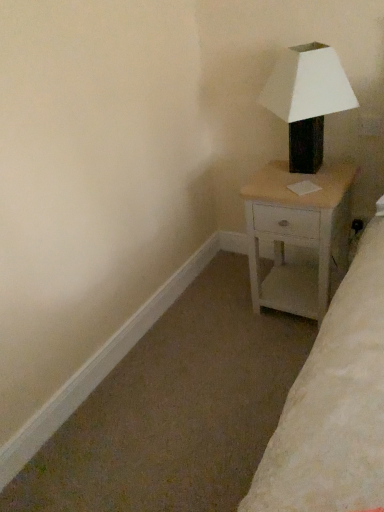
Identify the location of vacant space situated above white wood nightstand at right (from a real-world perspective). (306, 180).